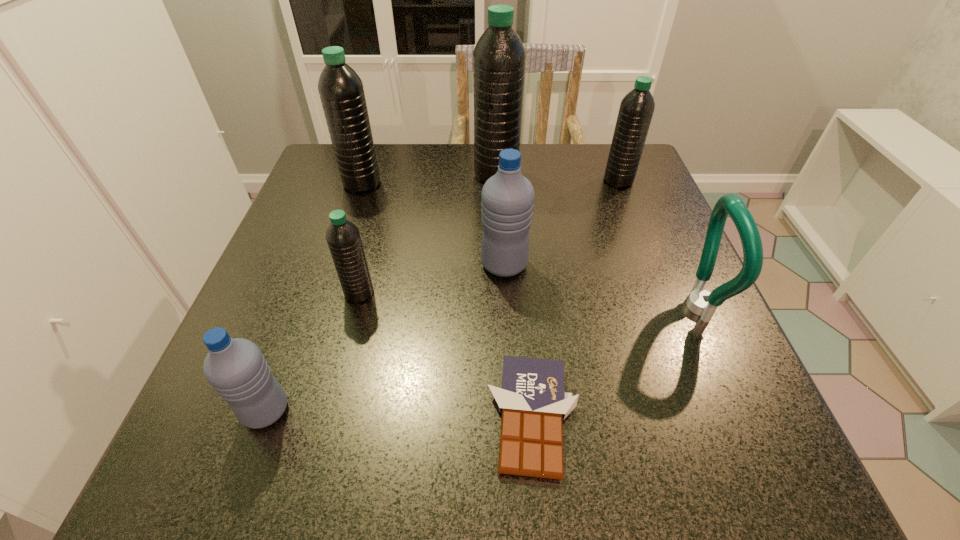
This screenshot has height=540, width=960. What are the coordinates of `the nearest black water bottle` in the screenshot? It's located at (343, 237).

The image size is (960, 540). Find the location of `the nearest water bottle`. the nearest water bottle is located at coordinates (236, 368).

At what (x,y) coordinates should I click in order to perform the action: click on the smaller blue water bottle. Please return your answer as a coordinate pair (x, y). The width and height of the screenshot is (960, 540). Looking at the image, I should click on (236, 368).

Identify the location of the shortest object. (532, 399).

Locate an element on the screen. Image resolution: width=960 pixels, height=540 pixels. vacant area situated 0.070m on the right of the second black water bottle from right to left is located at coordinates (546, 174).

In order to click on vacant space located on the front of the second tallest object in this screenshot , I will do `click(336, 265)`.

You are a GUI agent. You are given a task and a screenshot of the screen. Output one action in this format:
    pyautogui.click(x=<x>, y=<y>)
    Task: Click on the free space located 0.050m on the left of the rightmost black water bottle
    Image resolution: width=960 pixels, height=540 pixels.
    Given the screenshot: What is the action you would take?
    pyautogui.click(x=583, y=181)

Identify the location of free space located on the back of the farther blue water bottle. The width and height of the screenshot is (960, 540). (501, 214).

What are the coordinates of `vacant space located 0.300m at the jaws of the green bottle opener` in the screenshot? It's located at (508, 307).

Where is `free space located at the jaws of the green bottle opener`? free space located at the jaws of the green bottle opener is located at coordinates (650, 307).